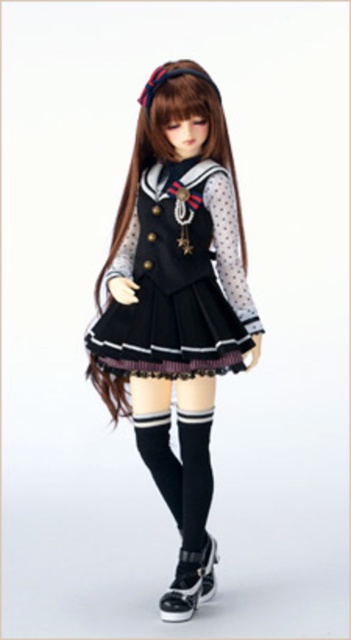
Locate an element on the screen. This screenshot has height=640, width=351. brown silky hair at center is located at coordinates tap(168, 140).

Is brown silky hair at center closer to camera compared to black knit socks at lower center?

Yes, it is.

This screenshot has height=640, width=351. Describe the element at coordinates (168, 140) in the screenshot. I see `brown silky hair at center` at that location.

In order to click on brown silky hair at center in this screenshot , I will do 168,140.

Does brown silky hair at center lie behind black leather shoe at lower center?

No, brown silky hair at center is closer to the viewer.

Is point (126, 186) positioned before point (183, 616)?

No, (126, 186) is behind (183, 616).

I want to click on brown silky hair at center, so click(168, 140).

Does matte black dress at center have a smaller size compared to black satin dress at center?

No.

Which is behind, point (168, 268) or point (175, 288)?

Point (168, 268)

Find the location of a particular element. Image resolution: width=351 pixels, height=640 pixels. matte black dress at center is located at coordinates (175, 305).